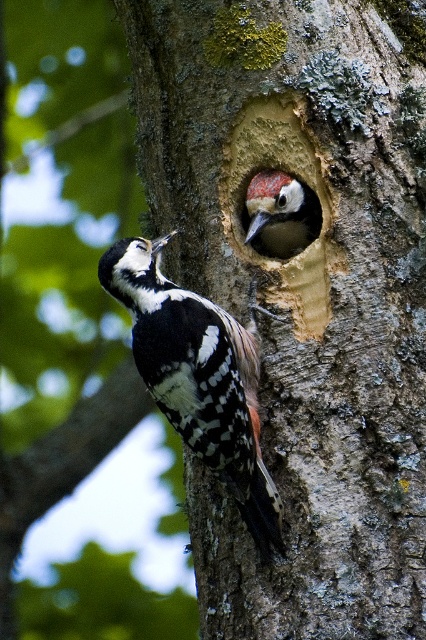
Question: Which object is farther from the camera taking this photo?

Choices:
 (A) white speckled woodpecker at left
 (B) speckled brown woodpecker at center

Answer: (B)

Question: Which point is closer to the camera taking this photo?

Choices:
 (A) (146, 346)
 (B) (284, 179)

Answer: (A)

Question: Considering the relative positions of white speckled woodpecker at left and speckled brown woodpecker at center in the image provided, where is white speckled woodpecker at left located with respect to speckled brown woodpecker at center?

Choices:
 (A) below
 (B) above

Answer: (A)

Question: Is white speckled woodpecker at left smaller than speckled brown woodpecker at center?

Choices:
 (A) no
 (B) yes

Answer: (A)

Question: Can you confirm if white speckled woodpecker at left is wider than speckled brown woodpecker at center?

Choices:
 (A) no
 (B) yes

Answer: (B)